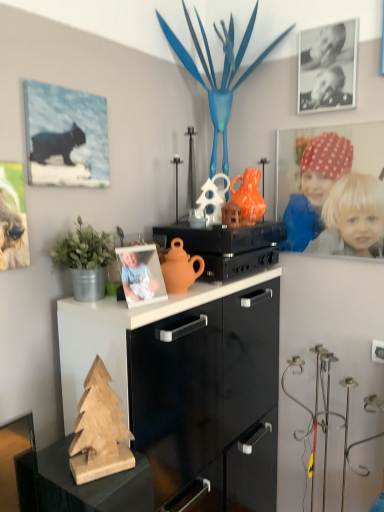
Question: Is the position of matte orange teapot at center less distant than that of black matte photo frame at upper right, which is the 2th picture frame in bottom-to-top order?

Choices:
 (A) no
 (B) yes

Answer: (B)

Question: Considering the relative positions of matte orange teapot at center and black matte photo frame at upper right, which appears as the second picture frame when viewed from the front, in the image provided, is matte orange teapot at center to the left of black matte photo frame at upper right, which appears as the second picture frame when viewed from the front, from the viewer's perspective?

Choices:
 (A) yes
 (B) no

Answer: (A)

Question: From the image's perspective, is matte orange teapot at center located beneath black matte photo frame at upper right, which is counted as the 2th picture frame, starting from the left?

Choices:
 (A) yes
 (B) no

Answer: (A)

Question: Can you confirm if matte orange teapot at center is taller than black matte photo frame at upper right, the 1th picture frame when ordered from right to left?

Choices:
 (A) yes
 (B) no

Answer: (B)

Question: Can you confirm if matte orange teapot at center is bigger than black matte photo frame at upper right, which appears as the second picture frame when viewed from the front?

Choices:
 (A) no
 (B) yes

Answer: (B)

Question: Can you confirm if matte orange teapot at center is smaller than black matte photo frame at upper right, which is the 1th picture frame in top-to-bottom order?

Choices:
 (A) yes
 (B) no

Answer: (B)

Question: Is green matte plant at left behind matte canvas print of cat at upper left, the 1th picture frame from the left?

Choices:
 (A) no
 (B) yes

Answer: (A)

Question: From a real-world perspective, is green matte plant at left over matte canvas print of cat at upper left, the 1th picture frame from the left?

Choices:
 (A) no
 (B) yes

Answer: (A)

Question: Is green matte plant at left taller than matte canvas print of cat at upper left, the 1th picture frame from the left?

Choices:
 (A) yes
 (B) no

Answer: (B)

Question: Is green matte plant at left at the left side of matte canvas print of cat at upper left, which is the first picture frame in front-to-back order?

Choices:
 (A) yes
 (B) no

Answer: (B)

Question: Can you confirm if green matte plant at left is bigger than matte canvas print of cat at upper left, the 1th picture frame from the left?

Choices:
 (A) yes
 (B) no

Answer: (A)

Question: Is green matte plant at left oriented away from matte canvas print of cat at upper left, marked as the second picture frame in a back-to-front arrangement?

Choices:
 (A) yes
 (B) no

Answer: (B)

Question: Is wooden christmas tree at lower left facing away from matte canvas print of cat at upper left, placed as the 2th picture frame when sorted from right to left?

Choices:
 (A) yes
 (B) no

Answer: (B)